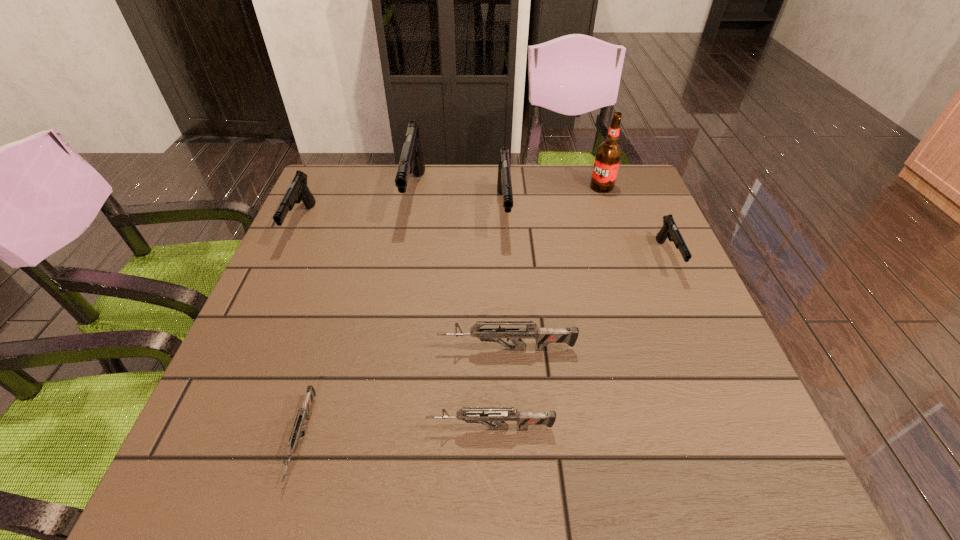
At what (x,y) coordinates should I click in order to perform the action: click on the seventh object from left to right. Please return your answer as a coordinate pair (x, y). The height and width of the screenshot is (540, 960). Looking at the image, I should click on (608, 155).

The width and height of the screenshot is (960, 540). Identify the location of root beer. (608, 155).

Where is `the fifth gun from right to left`? The height and width of the screenshot is (540, 960). the fifth gun from right to left is located at coordinates (411, 160).

Image resolution: width=960 pixels, height=540 pixels. I want to click on the tallest gun, so click(x=411, y=160).

The height and width of the screenshot is (540, 960). In order to click on the third tallest object in this screenshot , I will do `click(504, 186)`.

Find the location of a particular element. the sixth shortest gun is located at coordinates (504, 186).

Image resolution: width=960 pixels, height=540 pixels. I want to click on the leftmost gun, so click(x=298, y=189).

Find the location of a particular element. the fifth shortest gun is located at coordinates (298, 189).

At what (x,y) coordinates should I click in order to perform the action: click on the rightmost black gun. Please return your answer as a coordinate pair (x, y). Looking at the image, I should click on (669, 230).

I want to click on the rightmost gun, so click(x=669, y=230).